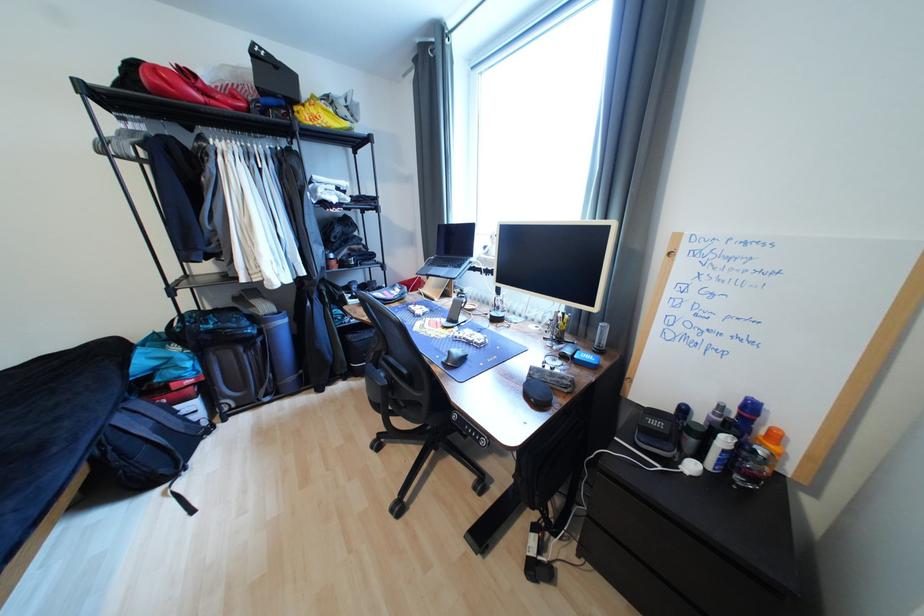
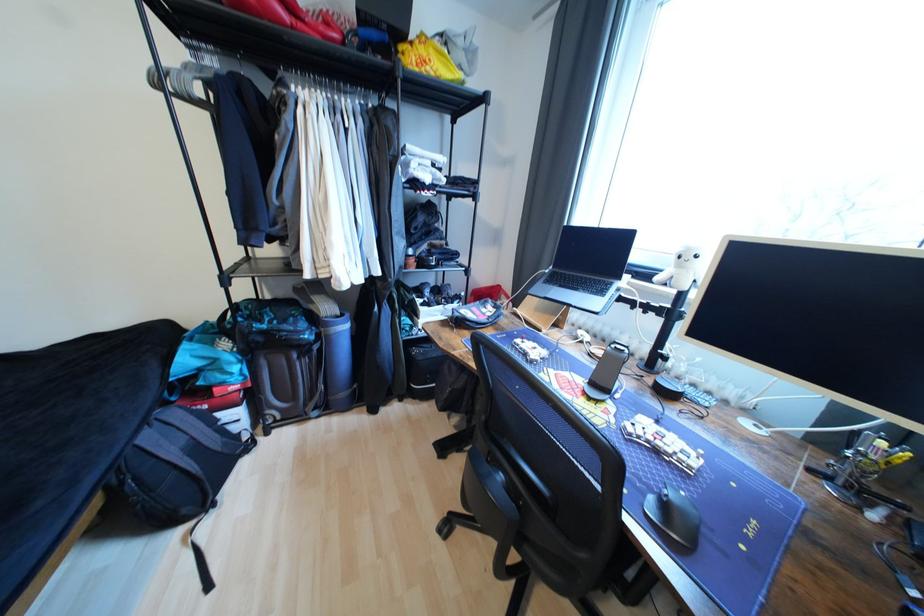
Locate, in the second image, the point that corresponds to pixel 128 421 in the first image.

(155, 439)